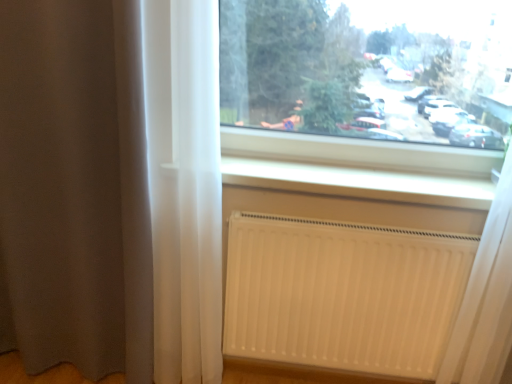
Where is `free location above white smooth radiator at lower center (from a real-world perspective)`? This screenshot has width=512, height=384. free location above white smooth radiator at lower center (from a real-world perspective) is located at coordinates (327, 171).